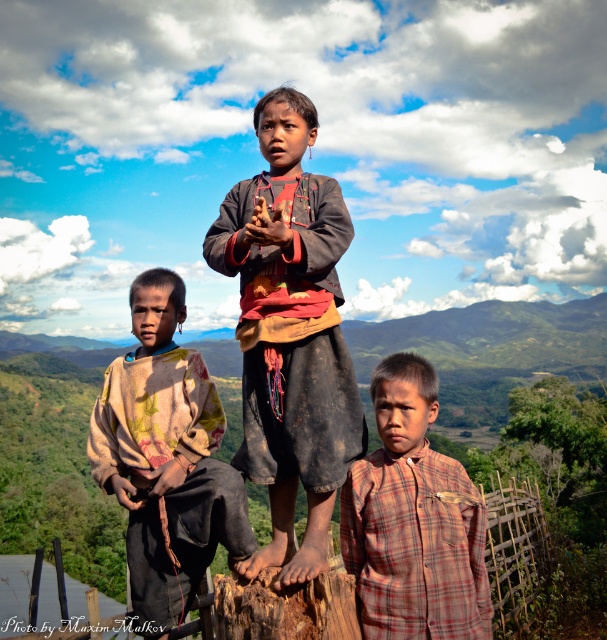
You are a tailor observing the children in the scene. You need to determine which of the two shirts, the dirty brown fabric shirt at center or the rustic brown shirt at left, requires more fabric to make a new one. Based on their sizes, which one would need more material?

The rustic brown shirt at left requires more fabric because it is larger in size than the dirty brown fabric shirt at center.

You are a photographer trying to capture a photo of the rustic brown shirt at left and the plaid fabric shirt at lower right. Based on their positions, which one is higher up in the frame?

The rustic brown shirt at left is above the plaid fabric shirt at lower right, so the rustic brown shirt at left is higher up in the frame.